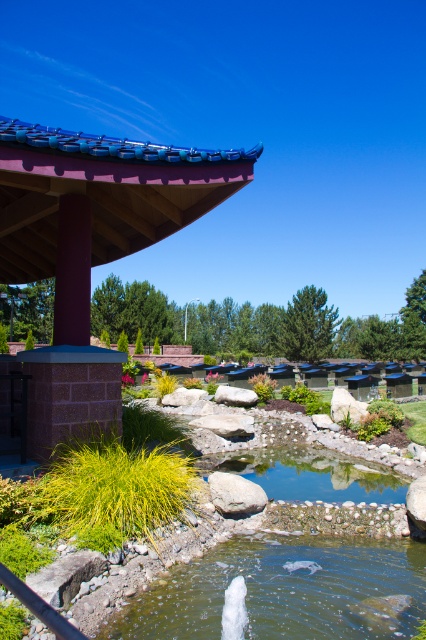
Question: Which of these objects is positioned closest to the green liquid water at lower center?

Choices:
 (A) gray rough rock at center
 (B) clear glass water at center

Answer: (A)

Question: Which object appears closest to the camera in this image?

Choices:
 (A) green liquid water at lower center
 (B) matte brick gazebo at upper left
 (C) gray rough rock at center
 (D) clear glass water at center

Answer: (A)

Question: Does green liquid water at lower center have a greater width compared to clear glass water at center?

Choices:
 (A) no
 (B) yes

Answer: (A)

Question: Which object is farther from the camera taking this photo?

Choices:
 (A) clear glass water at center
 (B) green liquid water at lower center

Answer: (A)

Question: Is green liquid water at lower center to the left of clear glass water at center from the viewer's perspective?

Choices:
 (A) no
 (B) yes

Answer: (B)

Question: Is matte brick gazebo at upper left wider than green liquid water at lower center?

Choices:
 (A) no
 (B) yes

Answer: (B)